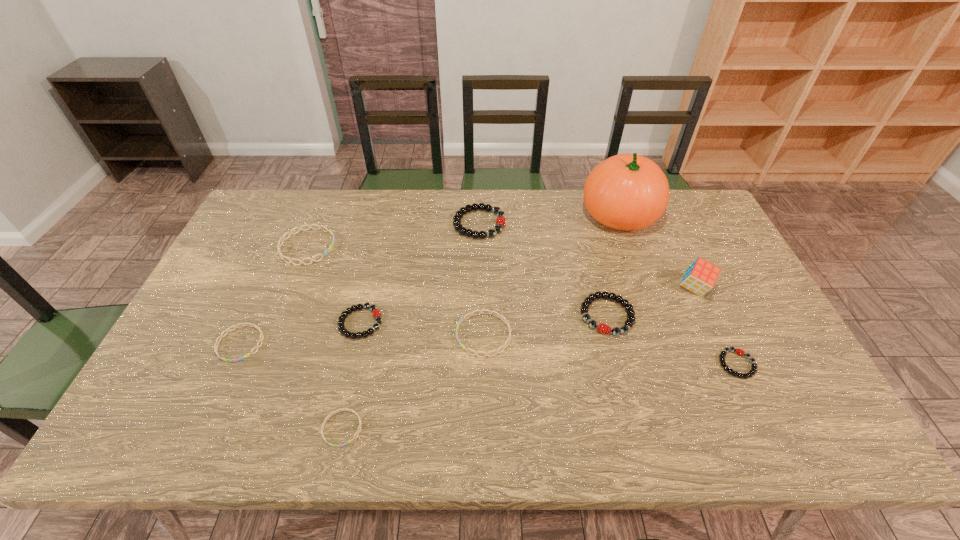
Identify the location of black bracelet that is the closest to the second bracelet from right to left. (738, 351).

Locate which black bracelet is the fourth closest to the second smallest blue bracelet. Please provide its 2D coordinates. Your answer should be formatted as a tuple, i.e. [(x, y)], where the tuple contains the x and y coordinates of a point satisfying the conditions above.

[(738, 351)]

Locate which blue bracelet ranks in proximity to the farthest blue bracelet. Please provide its 2D coordinates. Your answer should be formatted as a tuple, i.e. [(x, y)], where the tuple contains the x and y coordinates of a point satisfying the conditions above.

[(221, 336)]

Identify which blue bracelet is located as the second nearest to the rightmost blue bracelet. Please provide its 2D coordinates. Your answer should be formatted as a tuple, i.e. [(x, y)], where the tuple contains the x and y coordinates of a point satisfying the conditions above.

[(283, 238)]

Where is `free space that satisfies the following two spatial constraints: 1. on the front side of the nearest black bracelet; 2. on the right side of the tallest bracelet`? The image size is (960, 540). free space that satisfies the following two spatial constraints: 1. on the front side of the nearest black bracelet; 2. on the right side of the tallest bracelet is located at coordinates (479, 364).

Find the location of a particular element. This screenshot has width=960, height=540. free space that satisfies the following two spatial constraints: 1. on the surface of the farthest blue bracelet showing star-shaped elements; 2. on the back side of the cube is located at coordinates (291, 288).

Locate an element on the screen. The height and width of the screenshot is (540, 960). free spot that satisfies the following two spatial constraints: 1. on the surface of the farthest blue bracelet showing star-shaped elements; 2. on the right side of the rightmost bracelet is located at coordinates (260, 364).

I want to click on free spot that satisfies the following two spatial constraints: 1. on the surface of the biggest blue bracelet showing star-shaped elements; 2. on the surface of the third biggest blue bracelet showing star-shaped elements, so click(x=268, y=343).